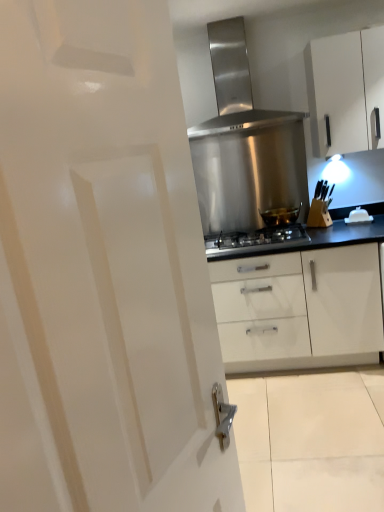
You are a GUI agent. You are given a task and a screenshot of the screen. Output one action in this format:
    pyautogui.click(x=<x>, y=<y>)
    Task: Click on the stainless steel range hood at upper center
    Image resolution: width=384 pixels, height=512 pixels.
    Given the screenshot: What is the action you would take?
    pyautogui.click(x=235, y=75)

What do you see at coordinates (255, 240) in the screenshot?
I see `stainless steel gas stove at center` at bounding box center [255, 240].

Describe the element at coordinates (280, 216) in the screenshot. The height and width of the screenshot is (512, 384). I see `shiny metallic pot at center` at that location.

The width and height of the screenshot is (384, 512). Describe the element at coordinates (102, 270) in the screenshot. I see `white glossy door at center` at that location.

Describe the element at coordinates (345, 90) in the screenshot. The height and width of the screenshot is (512, 384). I see `white glossy cabinet at upper right` at that location.

Image resolution: width=384 pixels, height=512 pixels. I want to click on stainless steel range hood at upper center, so pyautogui.click(x=235, y=75).

Which object is positioned more to the right, stainless steel range hood at upper center or white glossy door at center?

From the viewer's perspective, stainless steel range hood at upper center appears more on the right side.

Is stainless steel range hood at upper center smaller than white glossy door at center?

Actually, stainless steel range hood at upper center might be larger than white glossy door at center.

Does stainless steel range hood at upper center have a greater height compared to white glossy door at center?

In fact, stainless steel range hood at upper center may be shorter than white glossy door at center.

Looking at their sizes, would you say stainless steel range hood at upper center is wider or thinner than white glossy door at center?

In the image, stainless steel range hood at upper center appears to be wider than white glossy door at center.

In the scene shown: From a real-world perspective, which object rests below the other?

shiny metallic pot at center.

Considering the points (180, 141) and (275, 212), which point is in front, point (180, 141) or point (275, 212)?

Positioned in front is point (180, 141).

How far apart are white glossy door at center and shiny metallic pot at center?

white glossy door at center is 2.42 meters away from shiny metallic pot at center.

Can you confirm if white glossy door at center is thinner than shiny metallic pot at center?

Yes.

From a real-world perspective, who is located higher, shiny metallic pot at center or white glossy kettle at upper right?

From a 3D spatial view, shiny metallic pot at center is above.

Is shiny metallic pot at center spatially inside white glossy kettle at upper right, or outside of it?

shiny metallic pot at center is not enclosed by white glossy kettle at upper right.

Is shiny metallic pot at center bigger or smaller than white glossy kettle at upper right?

In the image, shiny metallic pot at center appears to be larger than white glossy kettle at upper right.

Considering the sizes of shiny metallic pot at center and white glossy kettle at upper right in the image, is shiny metallic pot at center wider or thinner than white glossy kettle at upper right?

In the image, shiny metallic pot at center appears to be wider than white glossy kettle at upper right.

How many degrees apart are the facing directions of white glossy door at center and white glossy kettle at upper right?

80.4 degrees separate the facing orientations of white glossy door at center and white glossy kettle at upper right.

Can you confirm if white glossy door at center is thinner than white glossy kettle at upper right?

No.

From a real-world perspective, is white glossy door at center physically above white glossy kettle at upper right?

Correct, in the physical world, white glossy door at center is higher than white glossy kettle at upper right.

Locate an element on the screen. door located on the left of white glossy kettle at upper right is located at coordinates (102, 270).

Which object is positioned more to the right, shiny metallic pot at center or stainless steel gas stove at center?

shiny metallic pot at center is more to the right.

Is point (290, 210) positioned after point (221, 233)?

No, (290, 210) is closer to viewer.

This screenshot has height=512, width=384. In the image, there is a stainless steel gas stove at center. In order to click on kitchen appliance above it (from the image's perspective) in this screenshot , I will do `click(280, 216)`.

Is there a large distance between white glossy cabinet at upper right and white glossy door at center?

Yes, white glossy cabinet at upper right is far from white glossy door at center.

Considering the relative positions of white glossy cabinet at upper right and white glossy door at center in the image provided, is white glossy cabinet at upper right to the right of white glossy door at center from the viewer's perspective?

Correct, you'll find white glossy cabinet at upper right to the right of white glossy door at center.

From a real-world perspective, is white glossy cabinet at upper right physically located above or below white glossy door at center?

In terms of real-world spatial position, white glossy cabinet at upper right is above white glossy door at center.

How many degrees apart are the facing directions of white glossy cabinet at upper right and white glossy door at center?

They differ by 69.7 degrees in their facing directions.

Is white glossy cabinet at upper right spatially inside stainless steel gas stove at center, or outside of it?

white glossy cabinet at upper right is outside stainless steel gas stove at center.

You are a GUI agent. You are given a task and a screenshot of the screen. Output one action in this format:
    pyautogui.click(x=<x>, y=<y>)
    Task: Click on the gas stove on the left of white glossy cabinet at upper right
    The width and height of the screenshot is (384, 512).
    Given the screenshot: What is the action you would take?
    pyautogui.click(x=255, y=240)

From the image's perspective, would you say white glossy cabinet at upper right is shown under stainless steel gas stove at center?

No, from the image's perspective, white glossy cabinet at upper right is not beneath stainless steel gas stove at center.

You are a GUI agent. You are given a task and a screenshot of the screen. Output one action in this format:
    pyautogui.click(x=<x>, y=<y>)
    Task: Click on the home appliance that is above the white glossy door at center (from the image's perspective)
    This screenshot has width=384, height=512.
    Given the screenshot: What is the action you would take?
    pyautogui.click(x=235, y=75)

The height and width of the screenshot is (512, 384). I want to click on door in front of the shiny metallic pot at center, so click(102, 270).

Based on their spatial positions, is stainless steel gas stove at center or shiny metallic pot at center further from stainless steel range hood at upper center?

Among the two, stainless steel gas stove at center is located further to stainless steel range hood at upper center.

Which object lies further to the anchor point stainless steel range hood at upper center, white glossy kettle at upper right or stainless steel gas stove at center?

Among the two, white glossy kettle at upper right is located further to stainless steel range hood at upper center.

When comparing their distances from white glossy cabinet at upper right, does stainless steel range hood at upper center or shiny metallic pot at center seem further?

shiny metallic pot at center lies further to white glossy cabinet at upper right than the other object.

When comparing their distances from white glossy kettle at upper right, does stainless steel range hood at upper center or white glossy door at center seem closer?

stainless steel range hood at upper center is positioned closer to the anchor white glossy kettle at upper right.

Which object lies nearer to the anchor point white glossy cabinet at upper right, shiny metallic pot at center or stainless steel gas stove at center?

Based on the image, shiny metallic pot at center appears to be nearer to white glossy cabinet at upper right.

When comparing their distances from white glossy kettle at upper right, does stainless steel range hood at upper center or stainless steel gas stove at center seem closer?

The object closer to white glossy kettle at upper right is stainless steel gas stove at center.

Based on their spatial positions, is white glossy kettle at upper right or white glossy cabinet at upper right further from stainless steel gas stove at center?

Based on the image, white glossy cabinet at upper right appears to be further to stainless steel gas stove at center.

Estimate the real-world distances between objects in this image. Which object is further from white glossy cabinet at upper right, stainless steel gas stove at center or shiny metallic pot at center?

stainless steel gas stove at center is positioned further to the anchor white glossy cabinet at upper right.

You are a GUI agent. You are given a task and a screenshot of the screen. Output one action in this format:
    pyautogui.click(x=<x>, y=<y>)
    Task: Click on the appliance between white glossy cabinet at upper right and stainless steel gas stove at center in the up-down direction
    This screenshot has width=384, height=512.
    Given the screenshot: What is the action you would take?
    (x=358, y=216)

At what (x,y) coordinates should I click in order to perform the action: click on appliance that lies between stainless steel range hood at upper center and stainless steel gas stove at center from top to bottom. Please return your answer as a coordinate pair (x, y). Looking at the image, I should click on (358, 216).

The width and height of the screenshot is (384, 512). In order to click on kitchen appliance between stainless steel gas stove at center and white glossy kettle at upper right in the horizontal direction in this screenshot , I will do `click(280, 216)`.

Image resolution: width=384 pixels, height=512 pixels. I want to click on home appliance located between white glossy door at center and shiny metallic pot at center in the depth direction, so click(x=235, y=75).